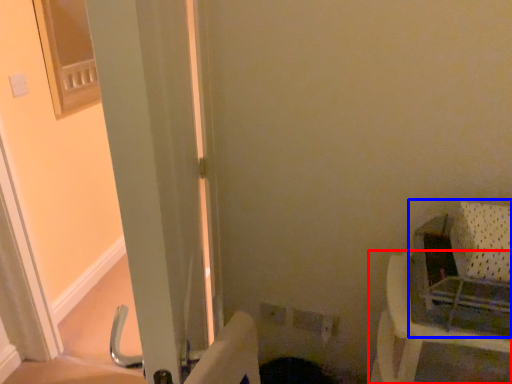
Question: Which object is further to the camera taking this photo, furniture (highlighted by a red box) or baby carriage (highlighted by a blue box)?

Choices:
 (A) furniture
 (B) baby carriage

Answer: (A)